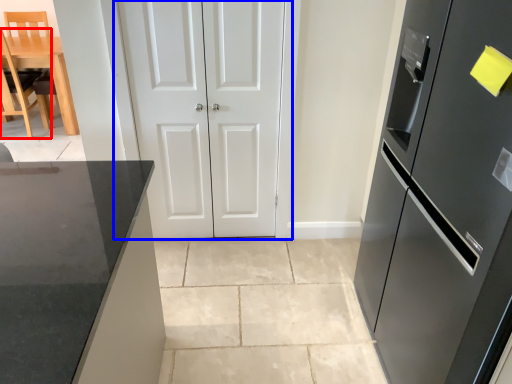
Question: Which point is further to the camera, chair (highlighted by a red box) or door (highlighted by a blue box)?

Choices:
 (A) chair
 (B) door

Answer: (A)